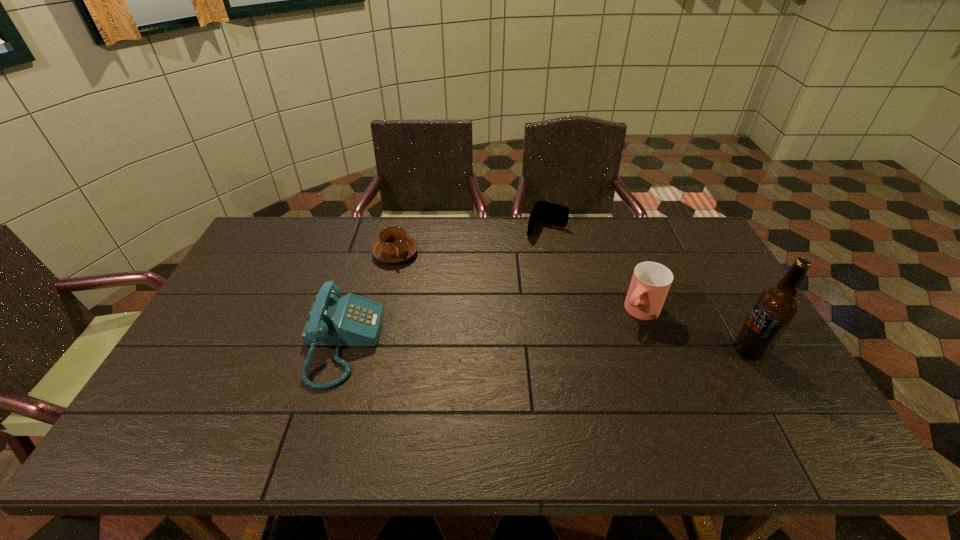
This screenshot has height=540, width=960. Identify the location of free space on the desktop that is between the telephone and the beer bottle and is positioned on the side of the fourth object from left to right with the handle. (602, 348).

At what (x,y) coordinates should I click in order to perform the action: click on vacant space on the desktop that is between the third tallest object and the tallest object and is positioned on the side of the cappuccino with the handle. Please return your answer as a coordinate pair (x, y). This screenshot has width=960, height=540. Looking at the image, I should click on (492, 346).

This screenshot has width=960, height=540. Find the location of `vacant space on the desktop that is between the telephone and the beer bottle and is positioned on the outer surface of the wallet`. vacant space on the desktop that is between the telephone and the beer bottle and is positioned on the outer surface of the wallet is located at coordinates (489, 346).